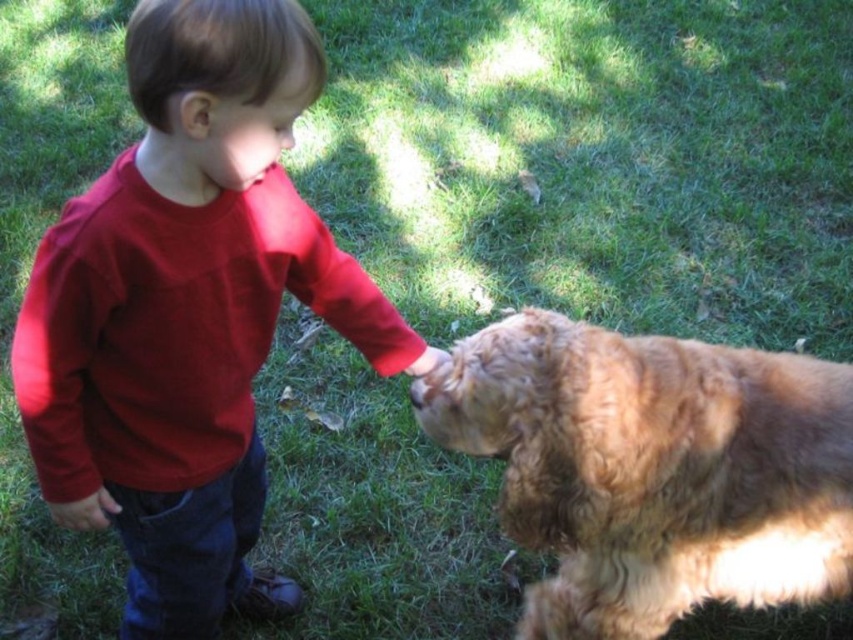
Is smooth red shirt at center positioned in front of golden fur dog at right?

Yes, smooth red shirt at center is closer to the viewer.

Where is `smooth red shirt at center`? This screenshot has height=640, width=853. smooth red shirt at center is located at coordinates (187, 310).

Find the location of `smooth red shirt at center`. smooth red shirt at center is located at coordinates (187, 310).